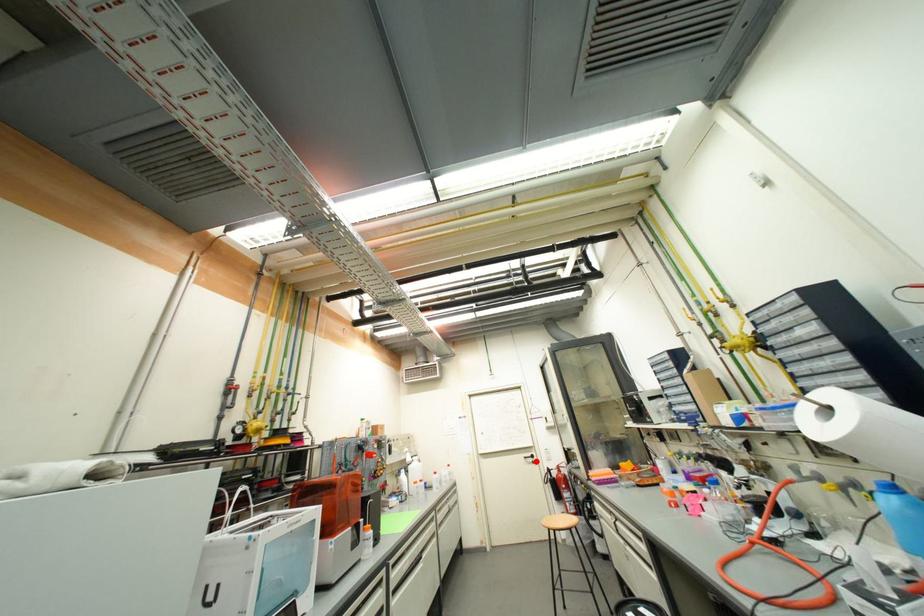
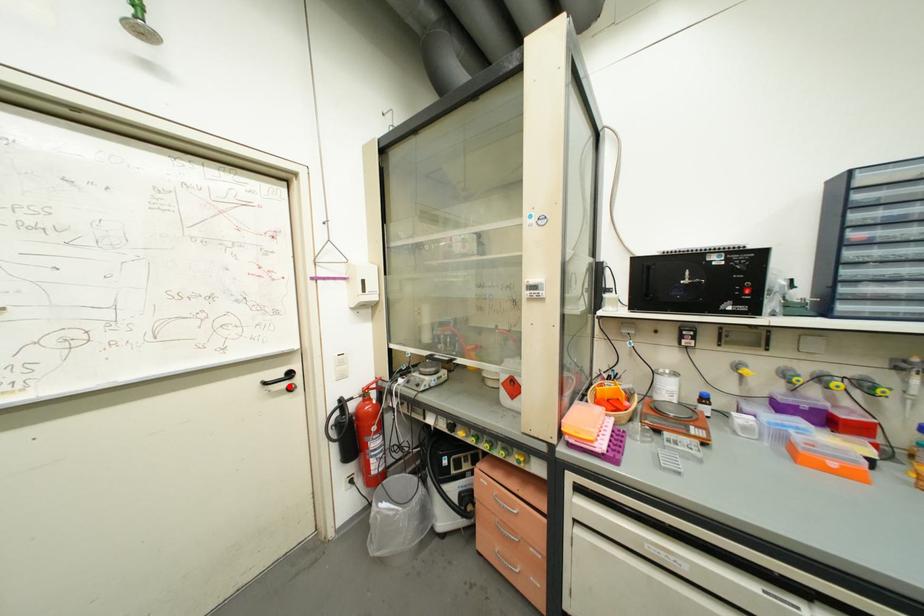
I am providing you with two images of the same scene from different viewpoints. A red point is marked on the first image and another point is marked on the second image. Are the points marked in image1 and image2 representing the same 3D position?

Yes